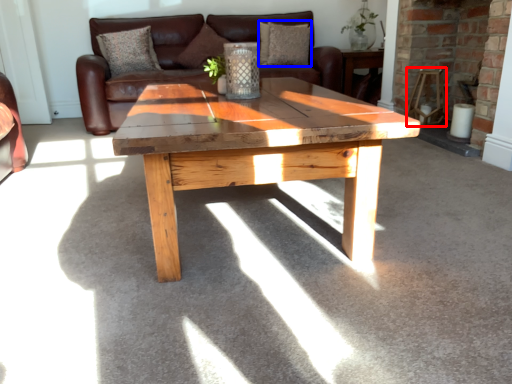
Question: Among these objects, which one is farthest to the camera, chair (highlighted by a red box) or pillow (highlighted by a blue box)?

Choices:
 (A) chair
 (B) pillow

Answer: (B)